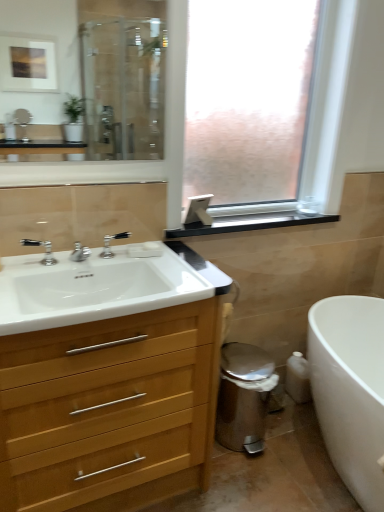
Identify the location of frosted glass window at center. This screenshot has width=384, height=512. (248, 101).

Find the location of `white matte soap at center`. white matte soap at center is located at coordinates (151, 246).

Identify the location of polished chrome faucet at center, which is the 2th tap in front-to-back order. Image resolution: width=384 pixels, height=512 pixels. (109, 242).

The width and height of the screenshot is (384, 512). What are the coordinates of `black matte window sill at upper center` in the screenshot? It's located at (250, 223).

I want to click on white glossy sink at left, so click(x=93, y=288).

From a real-world perspective, is white wood cabinet at left positioned over white glossy bathtub at lower right based on gravity?

Indeed, from a real-world perspective, white wood cabinet at left stands above white glossy bathtub at lower right.

Is there a large distance between white wood cabinet at left and white glossy bathtub at lower right?

Actually, white wood cabinet at left and white glossy bathtub at lower right are a little close together.

Locate an element on the screen. bathroom cabinet above the white glossy bathtub at lower right (from a real-world perspective) is located at coordinates (109, 410).

Considering the sizes of black matte window sill at upper center and white wood cabinet at left in the image, is black matte window sill at upper center bigger or smaller than white wood cabinet at left?

black matte window sill at upper center is smaller than white wood cabinet at left.

How different are the orientations of black matte window sill at upper center and white wood cabinet at left in degrees?

The facing directions of black matte window sill at upper center and white wood cabinet at left are 1.32 degrees apart.

From the image's perspective, is black matte window sill at upper center located above or below white wood cabinet at left?

Clearly, from the image's perspective, black matte window sill at upper center is above white wood cabinet at left.

From a real-world perspective, is black matte window sill at upper center located higher than white wood cabinet at left?

Yes, from a real-world perspective, black matte window sill at upper center is on top of white wood cabinet at left.

Where is `soap above the white glossy bathtub at lower right (from the image's perspective)`? The image size is (384, 512). soap above the white glossy bathtub at lower right (from the image's perspective) is located at coordinates (151, 246).

In terms of height, does white glossy bathtub at lower right look taller or shorter compared to white matte soap at center?

Clearly, white glossy bathtub at lower right is taller compared to white matte soap at center.

How much distance is there between white glossy bathtub at lower right and white matte soap at center?

39.25 inches.

Is white glossy bathtub at lower right positioned before white matte soap at center?

Yes, white glossy bathtub at lower right is in front of white matte soap at center.

Is polished chrome faucet at center, the 1th tap viewed from the right, not close to frosted glass window at center?

polished chrome faucet at center, the 1th tap viewed from the right, is positioned a significant distance from frosted glass window at center.

Is frosted glass window at center completely or partially inside polished chrome faucet at center, the first tap when ordered from back to front?

No, frosted glass window at center is not inside polished chrome faucet at center, the first tap when ordered from back to front.

Is polished chrome faucet at center, the 1th tap viewed from the right, bigger than frosted glass window at center?

No.

Is the position of polished chrome faucet at center, the 2th tap viewed from the left, more distant than that of frosted glass window at center?

Yes, polished chrome faucet at center, the 2th tap viewed from the left, is further from the viewer.

Which object is positioned more to the left, polished chrome faucet at sink left, positioned as the first tap in front-to-back order, or black matte window sill at upper center?

polished chrome faucet at sink left, positioned as the first tap in front-to-back order.

From the picture: Is polished chrome faucet at sink left, arranged as the second tap when viewed from the back, looking in the opposite direction of black matte window sill at upper center?

No.

From a real-world perspective, between polished chrome faucet at sink left, positioned as the first tap in front-to-back order, and black matte window sill at upper center, who is vertically higher?

polished chrome faucet at sink left, positioned as the first tap in front-to-back order, is physically above.

Does polished chrome faucet at sink left, arranged as the second tap when viewed from the back, lie in front of black matte window sill at upper center?

Yes, it is.

Is the surface of frosted glass window at center in direct contact with white glossy sink at left?

No, frosted glass window at center is not with white glossy sink at left.

In the image, is frosted glass window at center on the left side or the right side of white glossy sink at left?

In the image, frosted glass window at center appears on the right side of white glossy sink at left.

Who is more distant, white glossy sink at left or clear glass mirror at upper left?

clear glass mirror at upper left.

In the scene shown: Between white glossy sink at left and clear glass mirror at upper left, which one appears on the left side from the viewer's perspective?

clear glass mirror at upper left is more to the left.

From a real-world perspective, is white glossy sink at left on top of clear glass mirror at upper left?

No, from a real-world perspective, white glossy sink at left is not over clear glass mirror at upper left

Identify the location of bathroom cabinet in front of the white glossy bathtub at lower right. (109, 410).

Where is `bathroom cabinet that is on the left side of black matte window sill at upper center`? The height and width of the screenshot is (512, 384). bathroom cabinet that is on the left side of black matte window sill at upper center is located at coordinates (109, 410).

Which object lies further to the anchor point white glossy sink at left, polished chrome faucet at sink left, which is the second tap in right-to-left order, or white matte soap at center?

white matte soap at center lies further to white glossy sink at left than the other object.

Considering their positions, is white glossy sink at left positioned further to polished chrome faucet at sink left, arranged as the second tap when viewed from the back, than frosted glass window at center?

Among the two, frosted glass window at center is located further to polished chrome faucet at sink left, arranged as the second tap when viewed from the back.

Which object lies further to the anchor point white glossy bathtub at lower right, polished chrome faucet at sink left, positioned as the first tap in front-to-back order, or polished chrome faucet at center, which is the 2th tap in front-to-back order?

Among the two, polished chrome faucet at sink left, positioned as the first tap in front-to-back order, is located further to white glossy bathtub at lower right.

From the picture: Looking at the image, which one is located closer to polished chrome faucet at center, the 1th tap viewed from the right, frosted glass window at center or white glossy sink at left?

white glossy sink at left lies closer to polished chrome faucet at center, the 1th tap viewed from the right, than the other object.

Based on the photo, based on their spatial positions, is white glossy bathtub at lower right or clear glass mirror at upper left further from frosted glass window at center?

Among the two, clear glass mirror at upper left is located further to frosted glass window at center.

Which object lies further to the anchor point white wood cabinet at left, white glossy bathtub at lower right or polished chrome faucet at center, which is the 2th tap in front-to-back order?

Among the two, white glossy bathtub at lower right is located further to white wood cabinet at left.

Estimate the real-world distances between objects in this image. Which object is further from white glossy sink at left, white wood cabinet at left or white glossy bathtub at lower right?

white glossy bathtub at lower right.

Considering their positions, is clear glass mirror at upper left positioned closer to frosted glass window at center than white glossy bathtub at lower right?

The object closer to frosted glass window at center is white glossy bathtub at lower right.

Where is `mirror between frosted glass window at center and white wood cabinet at left vertically`? mirror between frosted glass window at center and white wood cabinet at left vertically is located at coordinates (100, 69).

Where is `sink between polished chrome faucet at sink left, positioned as the first tap in front-to-back order, and white wood cabinet at left in the up-down direction`? This screenshot has width=384, height=512. sink between polished chrome faucet at sink left, positioned as the first tap in front-to-back order, and white wood cabinet at left in the up-down direction is located at coordinates (93, 288).

Identify the location of soap between clear glass mirror at upper left and white glossy sink at left in the up-down direction. This screenshot has width=384, height=512. (151, 246).

Locate an element on the screen. This screenshot has height=512, width=384. sink located between white wood cabinet at left and white glossy bathtub at lower right in the left-right direction is located at coordinates (93, 288).